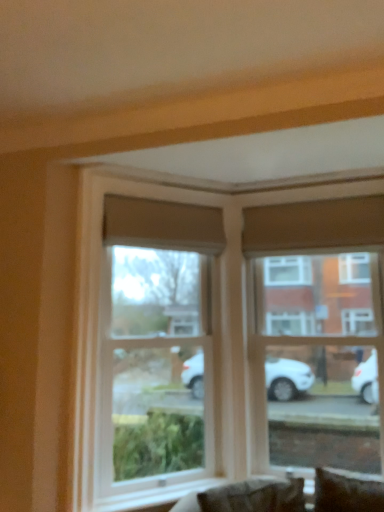
Question: In which direction should I rotate to look at clear glass window at center, marked as the second window in a right-to-left arrangement?

Choices:
 (A) right
 (B) left

Answer: (B)

Question: From a real-world perspective, is dark brown leather couch at lower center below clear glass window at center, marked as the second window in a right-to-left arrangement?

Choices:
 (A) no
 (B) yes

Answer: (B)

Question: Can you confirm if dark brown leather couch at lower center is taller than clear glass window at center, the 1th window in the left-to-right sequence?

Choices:
 (A) yes
 (B) no

Answer: (B)

Question: From the image's perspective, is dark brown leather couch at lower center below clear glass window at center, marked as the second window in a right-to-left arrangement?

Choices:
 (A) no
 (B) yes

Answer: (B)

Question: Considering the relative positions of dark brown leather couch at lower center and clear glass window at center, the 1th window in the left-to-right sequence, in the image provided, is dark brown leather couch at lower center to the left of clear glass window at center, the 1th window in the left-to-right sequence, from the viewer's perspective?

Choices:
 (A) no
 (B) yes

Answer: (A)

Question: Is dark brown leather couch at lower center aimed at clear glass window at center, the 1th window in the left-to-right sequence?

Choices:
 (A) no
 (B) yes

Answer: (A)

Question: Considering the relative sizes of dark brown leather couch at lower center and clear glass window at center, the 1th window in the left-to-right sequence, in the image provided, is dark brown leather couch at lower center thinner than clear glass window at center, the 1th window in the left-to-right sequence,?

Choices:
 (A) yes
 (B) no

Answer: (B)

Question: Is clear glass window at upper right, the first window viewed from the right, inside dark brown leather couch at lower center?

Choices:
 (A) no
 (B) yes

Answer: (A)

Question: Can you confirm if dark brown leather couch at lower center is bigger than clear glass window at upper right, the 2th window in the left-to-right sequence?

Choices:
 (A) no
 (B) yes

Answer: (A)

Question: Is dark brown leather couch at lower center to the right of clear glass window at upper right, the 2th window in the left-to-right sequence, from the viewer's perspective?

Choices:
 (A) yes
 (B) no

Answer: (B)

Question: From the image's perspective, does dark brown leather couch at lower center appear higher than clear glass window at upper right, the first window viewed from the right?

Choices:
 (A) no
 (B) yes

Answer: (A)

Question: Can you confirm if dark brown leather couch at lower center is taller than clear glass window at upper right, the first window viewed from the right?

Choices:
 (A) no
 (B) yes

Answer: (A)

Question: Is dark brown leather couch at lower center turned away from clear glass window at upper right, the first window viewed from the right?

Choices:
 (A) yes
 (B) no

Answer: (A)

Question: Can dark brown leather couch at lower center be found inside clear glass window at upper right, the 2th window in the left-to-right sequence?

Choices:
 (A) yes
 (B) no

Answer: (B)